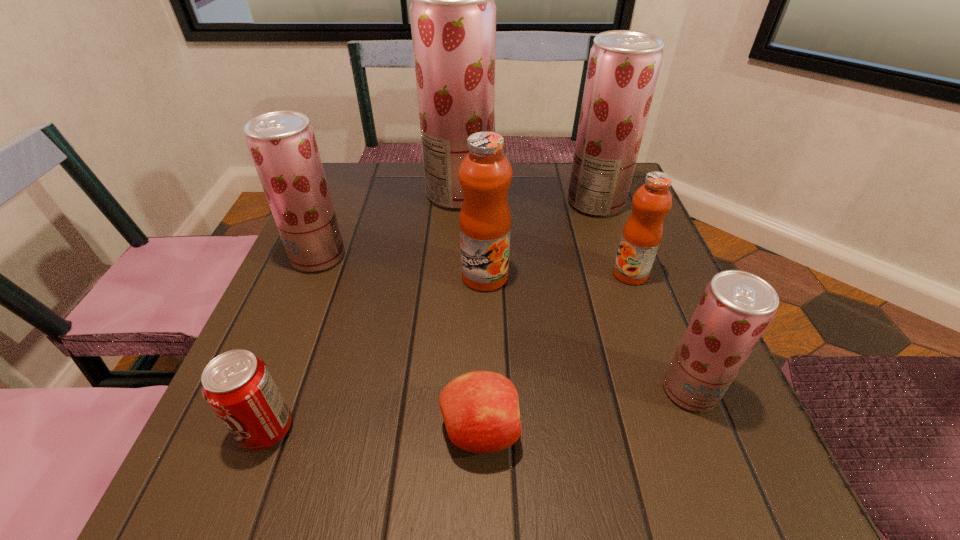
In the image, there is a desktop. Where is `vacant space at the left edge`? vacant space at the left edge is located at coordinates (357, 228).

In the image, there is a desktop. Where is `vacant space at the right edge`? vacant space at the right edge is located at coordinates [637, 401].

I want to click on vacant area at the far left corner of the desktop, so click(x=348, y=195).

Locate an element on the screen. The image size is (960, 540). free region at the near right corner of the desktop is located at coordinates (754, 455).

Locate an element on the screen. The height and width of the screenshot is (540, 960). free space between the leftmost fruit juice and the bigger orange fruit juice is located at coordinates point(401,267).

Locate an element on the screen. blank region between the red apple and the third smallest strawberry fruit juice is located at coordinates (538, 316).

Where is `free space between the third farthest strawberry fruit juice and the red apple`? The image size is (960, 540). free space between the third farthest strawberry fruit juice and the red apple is located at coordinates (399, 344).

Locate an element on the screen. The image size is (960, 540). free point between the smaller orange fruit juice and the nearest fruit juice is located at coordinates (660, 332).

The width and height of the screenshot is (960, 540). In order to click on empty location between the soda and the second nearest strawberry fruit juice in this screenshot , I will do `click(293, 343)`.

The image size is (960, 540). I want to click on unoccupied position between the third smallest strawberry fruit juice and the soda, so click(x=431, y=316).